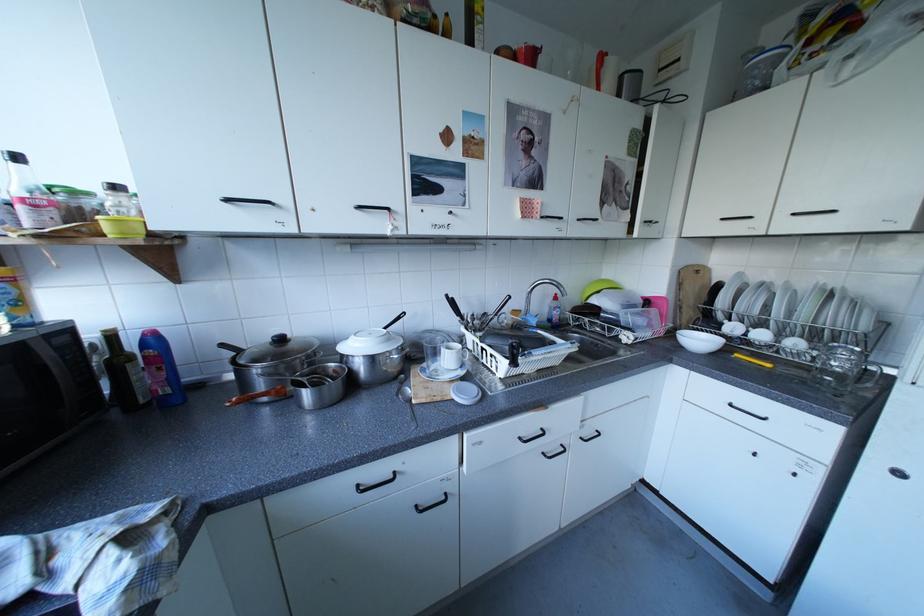
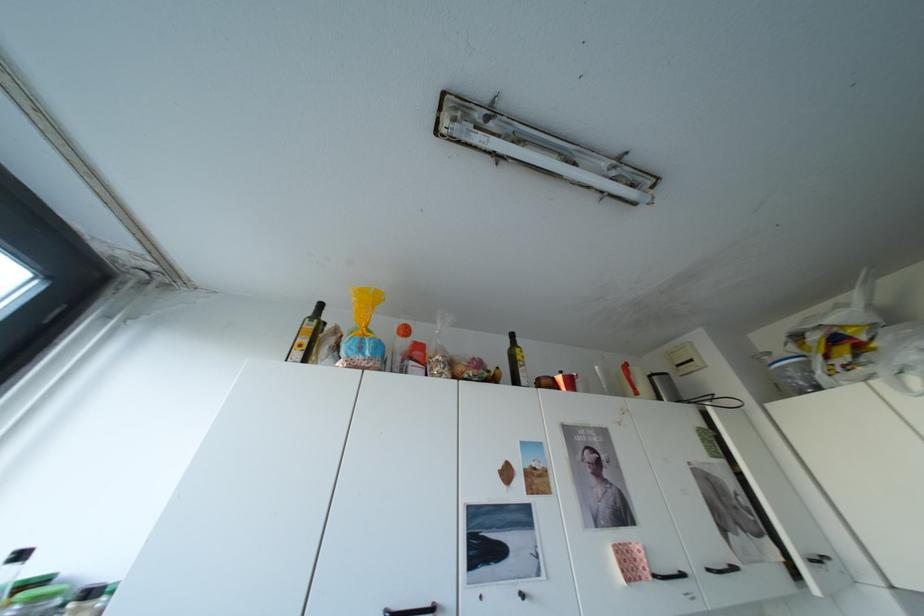
Question: The images are taken continuously from a first-person perspective. In which direction is your viewpoint rotating?

Choices:
 (A) Left
 (B) Right
 (C) Up
 (D) Down

Answer: (C)